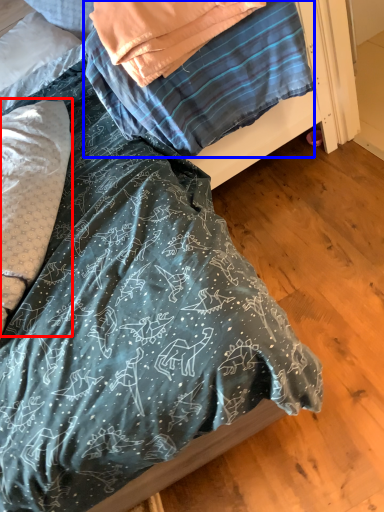
Question: Which object appears closest to the camera in this image, pillow (highlighted by a red box) or blanket (highlighted by a blue box)?

Choices:
 (A) pillow
 (B) blanket

Answer: (A)